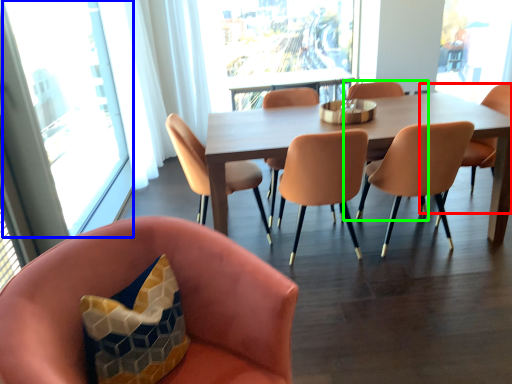
Question: Which is nearer to the chair (highlighted by a red box)? window (highlighted by a blue box) or armchair (highlighted by a green box).

Choices:
 (A) window
 (B) armchair

Answer: (B)